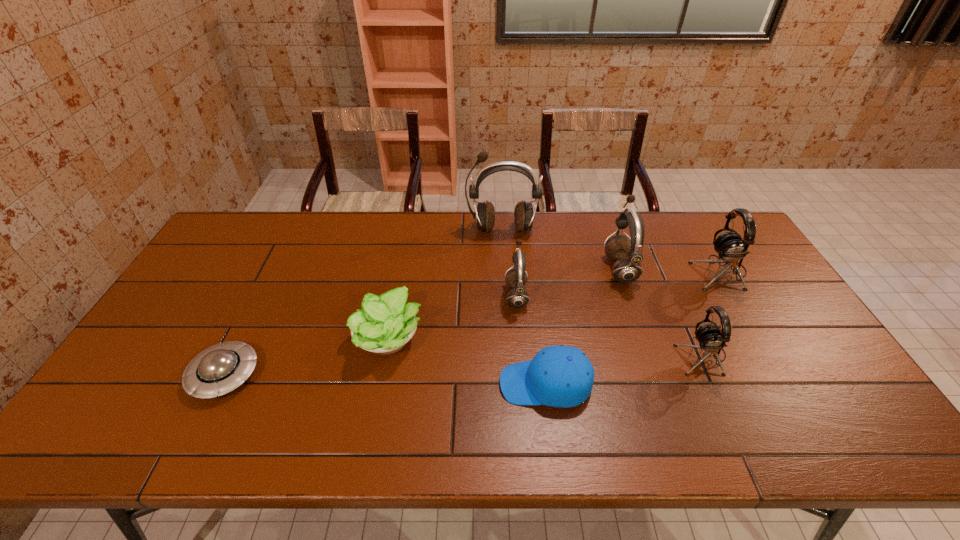
Where is `blank space located 0.210m on the ear pads of the smallest brown earphone`? Image resolution: width=960 pixels, height=540 pixels. blank space located 0.210m on the ear pads of the smallest brown earphone is located at coordinates (435, 295).

I want to click on free spot located 0.290m on the ear pads of the smallest brown earphone, so click(x=408, y=295).

What are the coordinates of `free space located on the left of the second object from right to left` in the screenshot? It's located at (587, 355).

Identify the location of blank space located on the front-facing side of the cap. The width and height of the screenshot is (960, 540). (431, 384).

You are a GUI agent. You are given a task and a screenshot of the screen. Output one action in this format:
    pyautogui.click(x=<x>, y=<y>)
    Task: Click on the vacant region located on the front-facing side of the cap
    
    Given the screenshot: What is the action you would take?
    pyautogui.click(x=451, y=384)

At what (x,y) coordinates should I click in order to perform the action: click on vacant space located on the front-facing side of the cap. Please return your answer as a coordinate pair (x, y). Looking at the image, I should click on (431, 384).

The width and height of the screenshot is (960, 540). I want to click on free space located on the right of the seventh object from right to left, so click(492, 338).

The width and height of the screenshot is (960, 540). I want to click on blank area located on the front of the saucer, so click(x=196, y=433).

The image size is (960, 540). In order to click on object situated at the right edge in this screenshot , I will do `click(730, 247)`.

Identify the location of free space at the far edge. (554, 250).